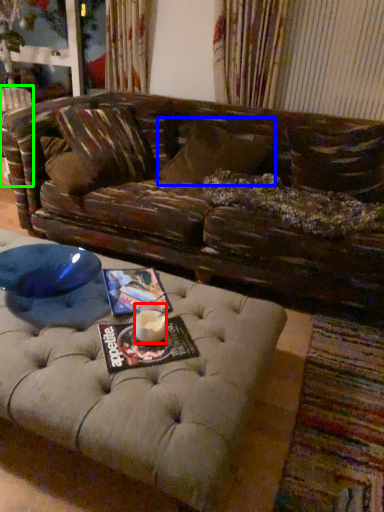
Question: Estimate the real-world distances between objects in this image. Which object is farther from beverage (highlighted by a red box), pillow (highlighted by a blue box) or swivel chair (highlighted by a green box)?

Choices:
 (A) pillow
 (B) swivel chair

Answer: (B)